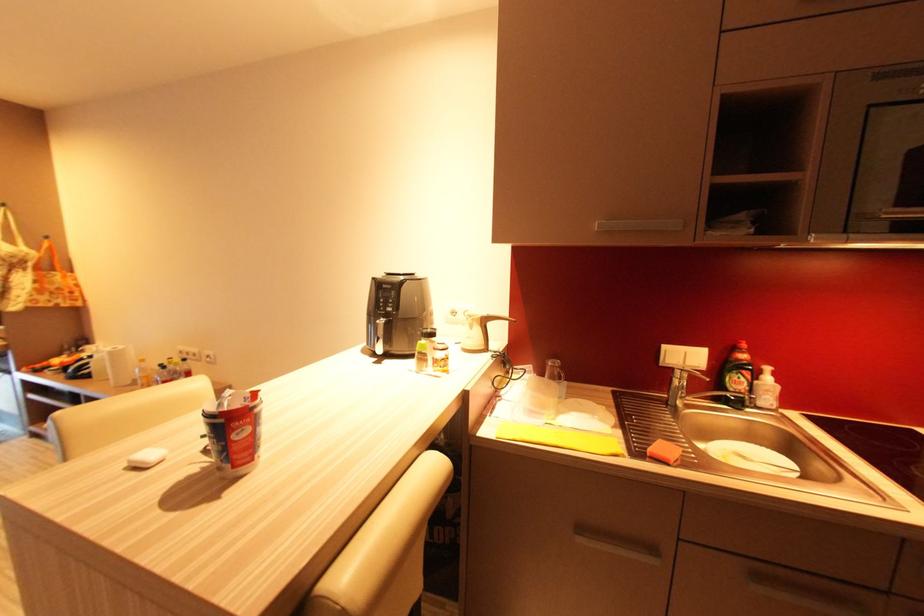
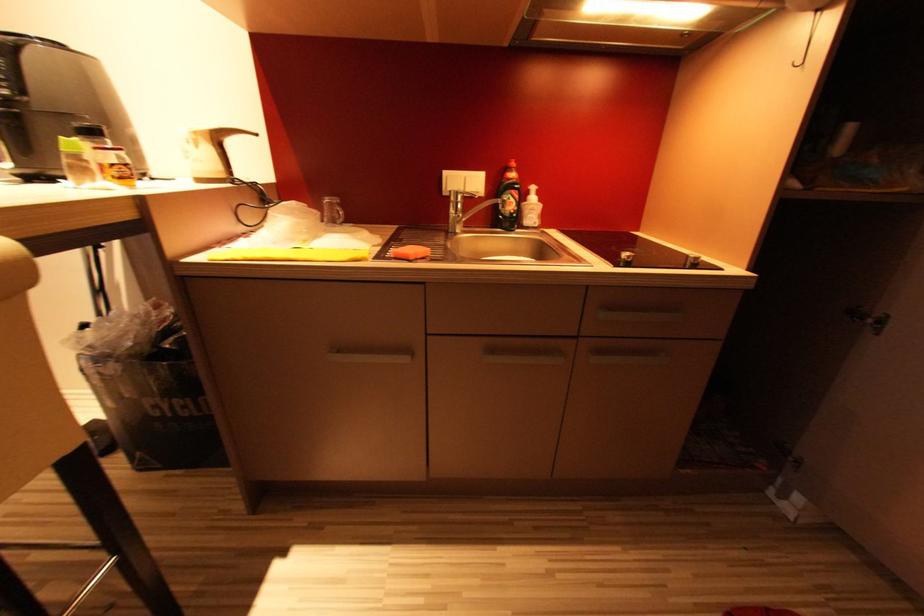
The first image is from the beginning of the video and the second image is from the end. How did the camera likely rotate when shooting the video?

The camera's rotation is toward right-down.